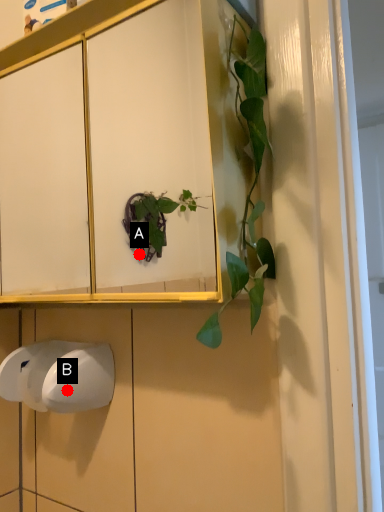
Question: Two points are circled on the image, labeled by A and B beside each circle. Which point appears closest to the camera in this image?

Choices:
 (A) A is closer
 (B) B is closer

Answer: (B)